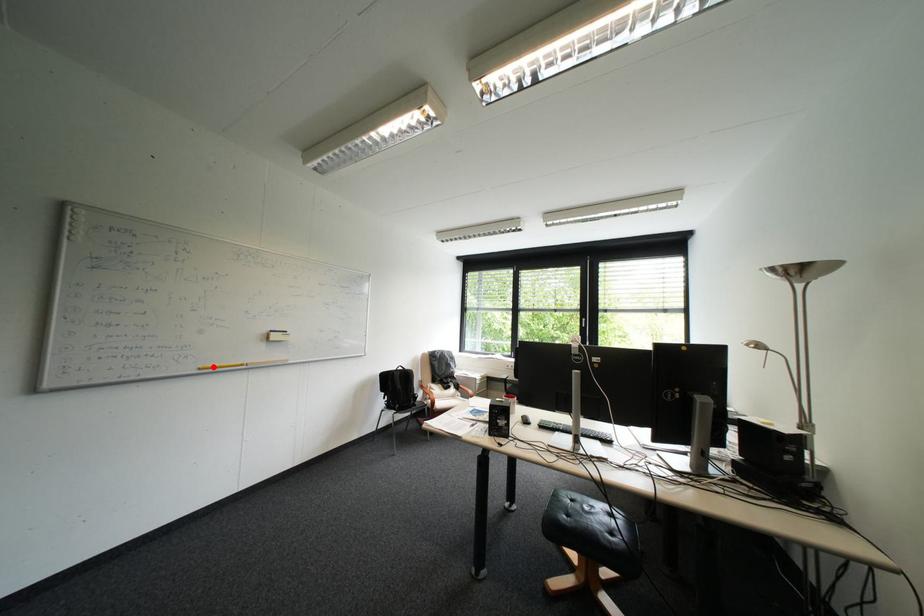
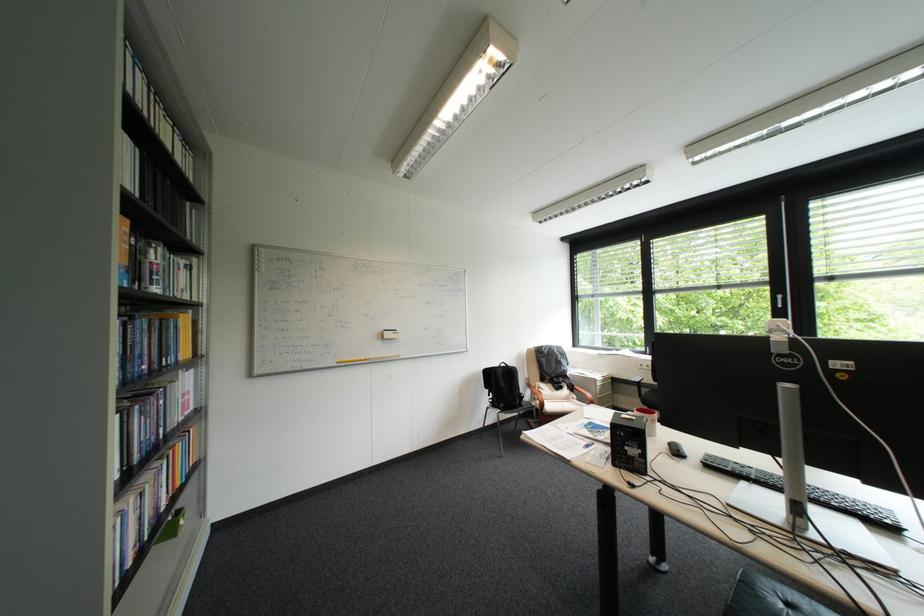
Locate, in the second image, the point that corresponds to the highlighted location in the first image.

(350, 361)